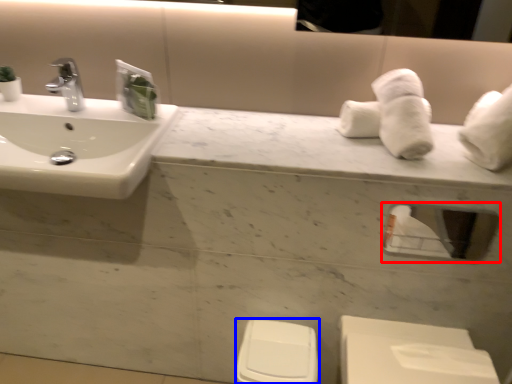
Question: Among these objects, which one is farthest to the camera, mirror (highlighted by a red box) or toilet bowl (highlighted by a blue box)?

Choices:
 (A) mirror
 (B) toilet bowl

Answer: (B)